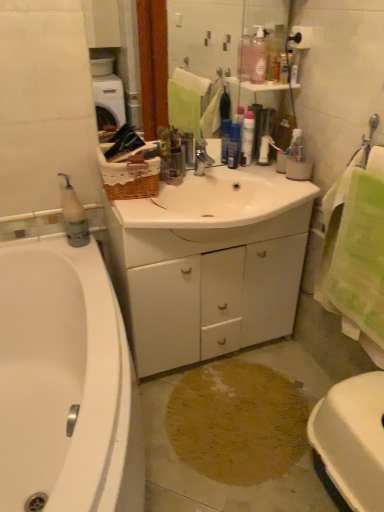
Question: From a real-world perspective, is white glossy toilet at lower right above or below white plastic bottle at left, arranged as the first cleaning product when viewed from the left?

Choices:
 (A) above
 (B) below

Answer: (B)

Question: Relative to white plastic bottle at left, marked as the 2th cleaning product in a top-to-bottom arrangement, is white glossy toilet at lower right in front or behind?

Choices:
 (A) behind
 (B) front

Answer: (B)

Question: Based on their relative distances, which object is nearer to the blue glossy spray can at center, the first toiletry in the left-to-right sequence?

Choices:
 (A) white glossy bathtub at left
 (B) pink translucent bottle at upper center, arranged as the 2th cleaning product when viewed from the left
 (C) white glossy toilet at lower right
 (D) white matte cabinet at center
 (E) translucent plastic bottle at upper right, arranged as the first toiletry when viewed from the top

Answer: (B)

Question: Estimate the real-world distances between objects in this image. Which object is farther from the white matte cabinet at center?

Choices:
 (A) white glossy bathtub at left
 (B) silver metallic faucet at center
 (C) green terry cloth towel at right
 (D) translucent plastic bottle at upper right, which is counted as the first toiletry, starting from the front
 (E) pink translucent bottle at upper center, which ranks as the first cleaning product in top-to-bottom order

Answer: (D)